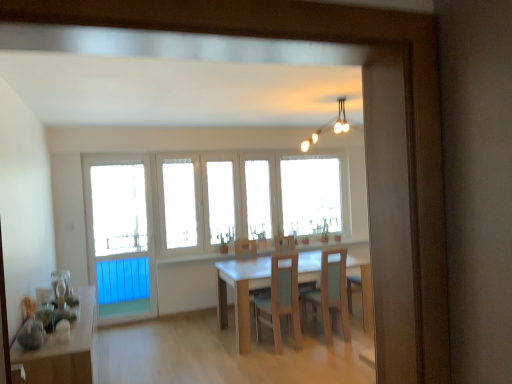
Question: From the image's perspective, is light wood chair at center, the 1th chair in the right-to-left sequence, positioned above or below wooden table at lower left, which ranks as the 1th table in left-to-right order?

Choices:
 (A) below
 (B) above

Answer: (B)

Question: Looking at their shapes, would you say light wood chair at center, positioned as the 2th chair in left-to-right order, is wider or thinner than wooden table at lower left, positioned as the 2th table in back-to-front order?

Choices:
 (A) wide
 (B) thin

Answer: (A)

Question: Which of these objects is positioned closest to the wooden table at lower left, positioned as the 2th table in back-to-front order?

Choices:
 (A) blue plastic screen door at left
 (B) white glass windows at center
 (C) light wood chair at center, positioned as the 2th chair in left-to-right order
 (D) wooden table at center, positioned as the second table in left-to-right order
 (E) light wood/matte chair at center, which is counted as the 2th chair, starting from the right

Answer: (D)

Question: Considering the real-world distances, which object is farthest from the white glass windows at center?

Choices:
 (A) blue plastic screen door at left
 (B) light wood/matte chair at center, which is counted as the 2th chair, starting from the right
 (C) wooden table at lower left, the first table viewed from the front
 (D) light wood chair at center, the 1th chair in the right-to-left sequence
 (E) light brown wooden chair at center

Answer: (C)